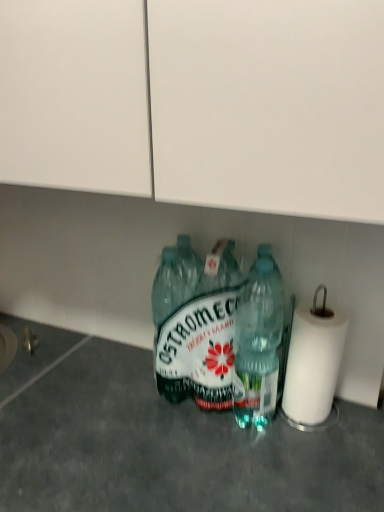
This screenshot has width=384, height=512. I want to click on vacant area that lies in front of white paper at right, so click(317, 465).